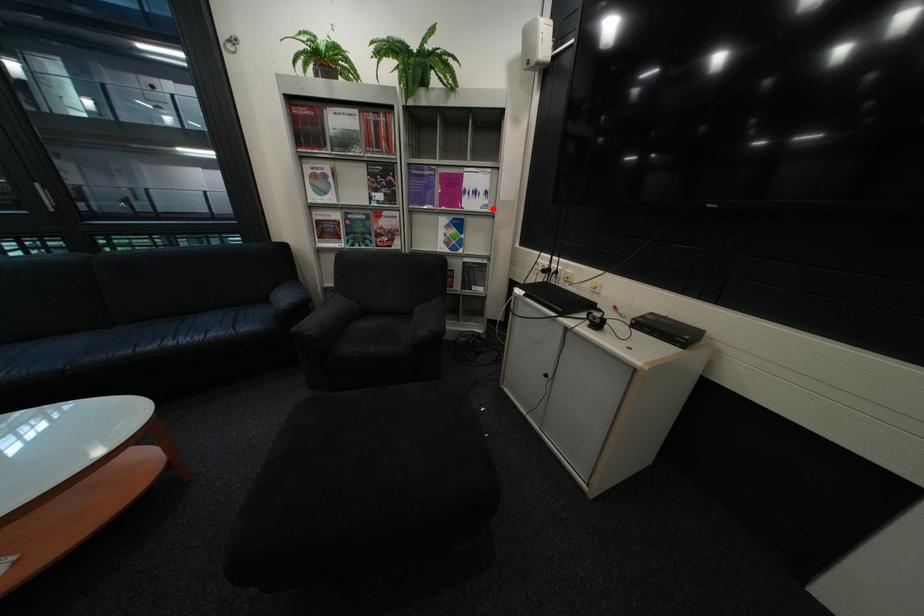
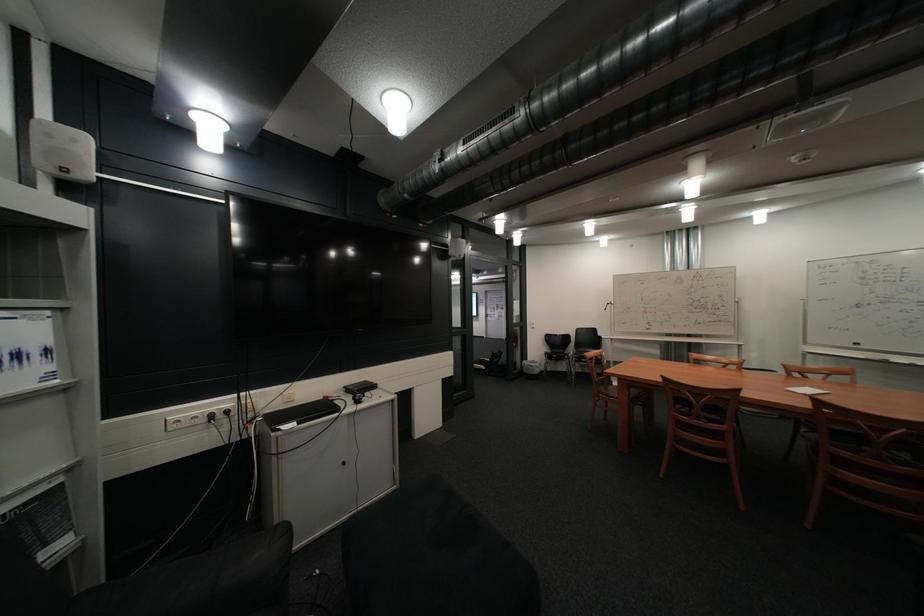
Where in the second image is the point corresponding to the highlighted location from the first image?

(46, 386)